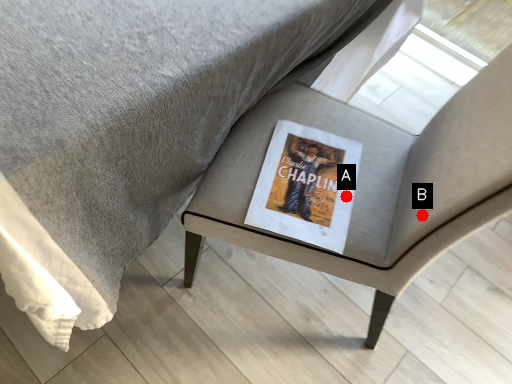
Question: Two points are circled on the image, labeled by A and B beside each circle. Which point is closer to the camera taking this photo?

Choices:
 (A) A is closer
 (B) B is closer

Answer: (B)